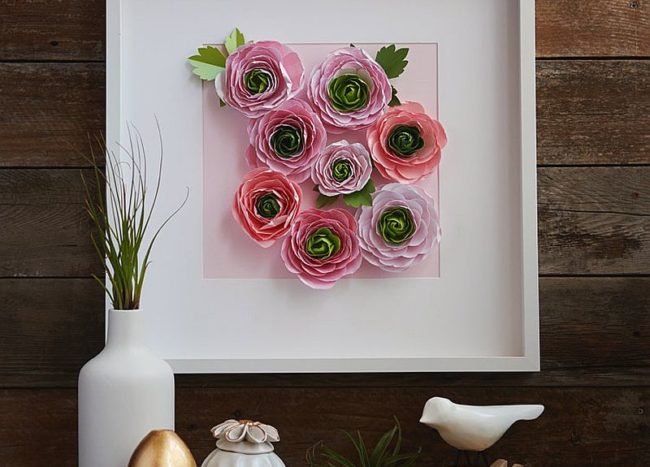
Where is `picture`? picture is located at coordinates (508, 146).